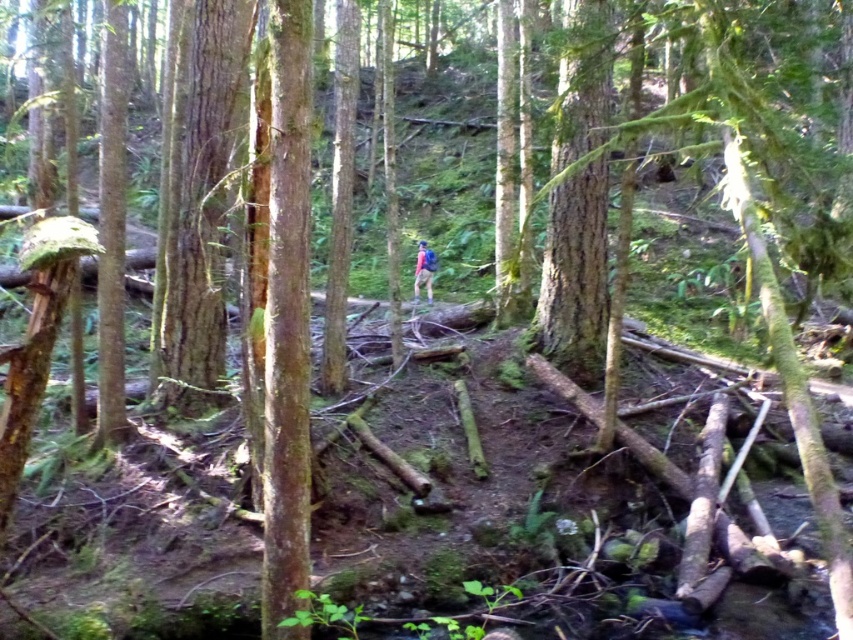
In the scene shown: You are a hiker navigating the forest path. You notice a smooth brown tree trunk at center and a matte pink backpack at center. Which object is positioned lower from the ground?

The smooth brown tree trunk at center is located below the matte pink backpack at center, so the smooth brown tree trunk at center is positioned lower from the ground.

You are a hiker standing on the narrow dirt path in the forest scene. You want to touch the smooth brown tree trunk at center. Can you reach it without moving from your current position?

The smooth brown tree trunk at center is 3.49 meters away from viewer. Since the average arm length of a person is about 0.7 meters, you cannot reach it without moving closer.

You are a hiker trying to navigate through the forest path. You notice a smooth brown tree trunk at center and a matte pink backpack at center. Which object is closer to the ground?

The matte pink backpack at center is closer to the ground because the smooth brown tree trunk at center is taller than it.